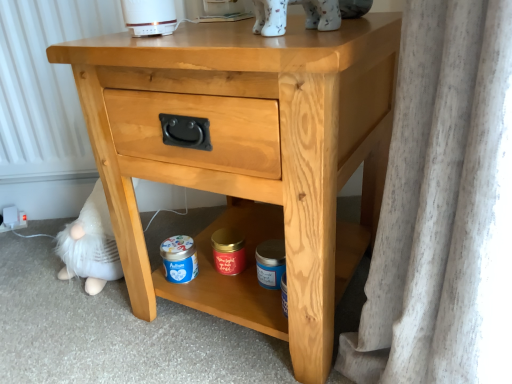
Question: From a real-world perspective, is white porcelain cat at upper center positioned above or below blue matte jar at lower center, acting as the 2th pottery starting from the left?

Choices:
 (A) below
 (B) above

Answer: (B)

Question: From the image's perspective, is white porcelain cat at upper center above or below blue matte jar at lower center, acting as the 2th pottery starting from the left?

Choices:
 (A) below
 (B) above

Answer: (B)

Question: Which of these objects is positioned closest to the light wood nightstand at center?

Choices:
 (A) blue matte jar at lower center
 (B) white porcelain cat at upper center
 (C) red matte candle at center, the 1th pottery from the left
 (D) blue matte jar at lower center, the first pottery from the right

Answer: (D)

Question: Estimate the real-world distances between objects in this image. Which object is farther from the light wood nightstand at center?

Choices:
 (A) blue matte jar at lower center
 (B) red matte candle at center, placed as the second pottery when sorted from right to left
 (C) white porcelain cat at upper center
 (D) blue matte jar at lower center, acting as the 2th pottery starting from the left

Answer: (A)